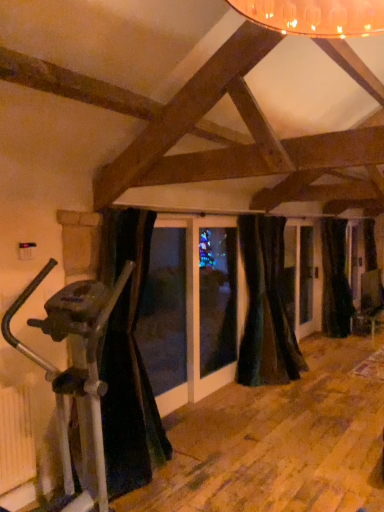
Where is `silver metallic stationary bicycle at left`? This screenshot has width=384, height=512. silver metallic stationary bicycle at left is located at coordinates (74, 366).

Describe the element at coordinates (128, 358) in the screenshot. I see `black velvet curtain at left, the 1th curtain from the left` at that location.

I want to click on black velvet curtain at left, which appears as the third curtain when viewed from the right, so click(x=128, y=358).

Where is `black velvet curtain at right, acting as the third curtain starting from the front`? Image resolution: width=384 pixels, height=512 pixels. black velvet curtain at right, acting as the third curtain starting from the front is located at coordinates (335, 279).

The height and width of the screenshot is (512, 384). I want to click on silver metallic stationary bicycle at left, so click(74, 366).

Is black velvet curtain at right, which is the 3th curtain from left to right, to the right of black velvet curtain at left, marked as the 1th curtain in a front-to-back arrangement, from the viewer's perspective?

Yes.

Are black velvet curtain at right, which is the 3th curtain from left to right, and black velvet curtain at left, the 1th curtain from the left, located far from each other?

Yes, black velvet curtain at right, which is the 3th curtain from left to right, and black velvet curtain at left, the 1th curtain from the left, are located far from each other.

Which point is more forward, (346, 225) or (74, 420)?

Point (74, 420)

How different are the orientations of black velvet curtain at right, acting as the third curtain starting from the front, and velvet dark green curtain at center, acting as the 2th curtain starting from the left, in degrees?

The angle between the facing direction of black velvet curtain at right, acting as the third curtain starting from the front, and the facing direction of velvet dark green curtain at center, acting as the 2th curtain starting from the left, is 0.00225 degrees.

Between black velvet curtain at right, acting as the third curtain starting from the front, and velvet dark green curtain at center, acting as the 2th curtain starting from the left, which one has smaller width?

black velvet curtain at right, acting as the third curtain starting from the front.

Considering the sizes of black velvet curtain at right, the 1th curtain positioned from the right, and velvet dark green curtain at center, the 2th curtain when ordered from front to back, in the image, is black velvet curtain at right, the 1th curtain positioned from the right, taller or shorter than velvet dark green curtain at center, the 2th curtain when ordered from front to back,?

Clearly, black velvet curtain at right, the 1th curtain positioned from the right, is taller compared to velvet dark green curtain at center, the 2th curtain when ordered from front to back.

The image size is (384, 512). I want to click on curtain behind the velvet dark green curtain at center, acting as the 2th curtain starting from the left, so [x=335, y=279].

Could you tell me if black velvet curtain at left, the 1th curtain from the left, is turned towards velvet dark green curtain at center, acting as the 2th curtain starting from the left?

No, black velvet curtain at left, the 1th curtain from the left, does not turn towards velvet dark green curtain at center, acting as the 2th curtain starting from the left.

Considering the sizes of black velvet curtain at left, the 1th curtain from the left, and velvet dark green curtain at center, acting as the 2th curtain starting from the left, in the image, is black velvet curtain at left, the 1th curtain from the left, taller or shorter than velvet dark green curtain at center, acting as the 2th curtain starting from the left,?

Clearly, black velvet curtain at left, the 1th curtain from the left, is shorter compared to velvet dark green curtain at center, acting as the 2th curtain starting from the left.

Does black velvet curtain at left, the 1th curtain from the left, have a larger size compared to velvet dark green curtain at center, positioned as the 2th curtain in right-to-left order?

Indeed, black velvet curtain at left, the 1th curtain from the left, has a larger size compared to velvet dark green curtain at center, positioned as the 2th curtain in right-to-left order.

Can you confirm if black velvet curtain at left, marked as the 1th curtain in a front-to-back arrangement, is thinner than velvet dark green curtain at center, acting as the 2th curtain starting from the left?

No.

Could you tell me if silver metallic stationary bicycle at left is turned towards velvet dark green curtain at center, the second curtain from the back?

No, silver metallic stationary bicycle at left is not oriented towards velvet dark green curtain at center, the second curtain from the back.

Is silver metallic stationary bicycle at left inside the boundaries of velvet dark green curtain at center, acting as the 2th curtain starting from the left, or outside?

silver metallic stationary bicycle at left is located beyond the bounds of velvet dark green curtain at center, acting as the 2th curtain starting from the left.

In the scene shown: Measure the distance between silver metallic stationary bicycle at left and velvet dark green curtain at center, the 2th curtain when ordered from front to back.

9.31 feet.

Would you say velvet dark green curtain at center, positioned as the 2th curtain in right-to-left order, contains silver metallic stationary bicycle at left?

No.

From the image's perspective, is velvet dark green curtain at center, acting as the 2th curtain starting from the left, on top of silver metallic stationary bicycle at left?

Yes, from the image's perspective, velvet dark green curtain at center, acting as the 2th curtain starting from the left, is above silver metallic stationary bicycle at left.

Is velvet dark green curtain at center, the 2th curtain when ordered from front to back, closer to the viewer compared to silver metallic stationary bicycle at left?

No, velvet dark green curtain at center, the 2th curtain when ordered from front to back, is further to the viewer.

Does black velvet curtain at right, the 1th curtain positioned from the back, lie in front of silver metallic stationary bicycle at left?

That is False.

How different are the orientations of black velvet curtain at right, which is the 3th curtain from left to right, and silver metallic stationary bicycle at left in degrees?

There is a 0.2-degree angle between the facing directions of black velvet curtain at right, which is the 3th curtain from left to right, and silver metallic stationary bicycle at left.

Is black velvet curtain at right, the 1th curtain positioned from the back, bigger or smaller than silver metallic stationary bicycle at left?

In the image, black velvet curtain at right, the 1th curtain positioned from the back, appears to be smaller than silver metallic stationary bicycle at left.

From a real-world perspective, is black velvet curtain at right, which is the 3th curtain from left to right, on silver metallic stationary bicycle at left?

Yes.

From the picture: Does velvet dark green curtain at center, the 2th curtain when ordered from front to back, contain black velvet curtain at left, which appears as the third curtain when viewed from the right?

No, black velvet curtain at left, which appears as the third curtain when viewed from the right, is not a part of velvet dark green curtain at center, the 2th curtain when ordered from front to back.

Is velvet dark green curtain at center, acting as the 2th curtain starting from the left, thinner than black velvet curtain at left, marked as the third curtain in a back-to-front arrangement?

Correct, the width of velvet dark green curtain at center, acting as the 2th curtain starting from the left, is less than that of black velvet curtain at left, marked as the third curtain in a back-to-front arrangement.

What's the angular difference between velvet dark green curtain at center, positioned as the 2th curtain in right-to-left order, and black velvet curtain at left, marked as the third curtain in a back-to-front arrangement,'s facing directions?

0.00028 degrees separate the facing orientations of velvet dark green curtain at center, positioned as the 2th curtain in right-to-left order, and black velvet curtain at left, marked as the third curtain in a back-to-front arrangement.

From the image's perspective, is velvet dark green curtain at center, the second curtain from the back, located above black velvet curtain at left, marked as the 1th curtain in a front-to-back arrangement?

Yes, from the image's perspective, velvet dark green curtain at center, the second curtain from the back, is over black velvet curtain at left, marked as the 1th curtain in a front-to-back arrangement.

Locate an element on the screen. This screenshot has height=512, width=384. the 2nd curtain behind the black velvet curtain at left, marked as the 1th curtain in a front-to-back arrangement, counting from the anchor's position is located at coordinates (335, 279).

You are a GUI agent. You are given a task and a screenshot of the screen. Output one action in this format:
    pyautogui.click(x=<x>, y=<y>)
    Task: Click on the curtain that is the 1st one when counting downward from the black velvet curtain at right, the 1th curtain positioned from the back (from the image's perspective)
    
    Given the screenshot: What is the action you would take?
    pyautogui.click(x=266, y=306)

Which object lies nearer to the anchor point black velvet curtain at left, the 1th curtain from the left, silver metallic stationary bicycle at left or velvet dark green curtain at center, the 2th curtain when ordered from front to back?

silver metallic stationary bicycle at left lies closer to black velvet curtain at left, the 1th curtain from the left, than the other object.

Considering their positions, is black velvet curtain at right, the 1th curtain positioned from the right, positioned closer to black velvet curtain at left, which appears as the third curtain when viewed from the right, than velvet dark green curtain at center, the second curtain from the back?

velvet dark green curtain at center, the second curtain from the back, lies closer to black velvet curtain at left, which appears as the third curtain when viewed from the right, than the other object.

Looking at the image, which one is located closer to black velvet curtain at left, marked as the 1th curtain in a front-to-back arrangement, silver metallic stationary bicycle at left or black velvet curtain at right, which is the 3th curtain from left to right?

silver metallic stationary bicycle at left is positioned closer to the anchor black velvet curtain at left, marked as the 1th curtain in a front-to-back arrangement.

Looking at the image, which one is located further to silver metallic stationary bicycle at left, black velvet curtain at left, which appears as the third curtain when viewed from the right, or black velvet curtain at right, the 1th curtain positioned from the right?

The object further to silver metallic stationary bicycle at left is black velvet curtain at right, the 1th curtain positioned from the right.

When comparing their distances from silver metallic stationary bicycle at left, does velvet dark green curtain at center, acting as the 2th curtain starting from the left, or black velvet curtain at right, acting as the third curtain starting from the front, seem closer?

velvet dark green curtain at center, acting as the 2th curtain starting from the left, lies closer to silver metallic stationary bicycle at left than the other object.

Looking at the image, which one is located closer to silver metallic stationary bicycle at left, black velvet curtain at right, the 1th curtain positioned from the back, or black velvet curtain at left, which appears as the third curtain when viewed from the right?

black velvet curtain at left, which appears as the third curtain when viewed from the right.

Estimate the real-world distances between objects in this image. Which object is further from black velvet curtain at left, which appears as the third curtain when viewed from the right, velvet dark green curtain at center, positioned as the 2th curtain in right-to-left order, or black velvet curtain at right, the 1th curtain positioned from the right?

black velvet curtain at right, the 1th curtain positioned from the right, lies further to black velvet curtain at left, which appears as the third curtain when viewed from the right, than the other object.

Considering their positions, is black velvet curtain at left, which appears as the third curtain when viewed from the right, positioned further to velvet dark green curtain at center, the 2th curtain when ordered from front to back, than silver metallic stationary bicycle at left?

Based on the image, silver metallic stationary bicycle at left appears to be further to velvet dark green curtain at center, the 2th curtain when ordered from front to back.

At what (x,y) coordinates should I click in order to perform the action: click on curtain between black velvet curtain at left, marked as the third curtain in a back-to-front arrangement, and black velvet curtain at right, the 1th curtain positioned from the right, from front to back. Please return your answer as a coordinate pair (x, y). The image size is (384, 512). Looking at the image, I should click on (266, 306).

Where is `curtain positioned between silver metallic stationary bicycle at left and velvet dark green curtain at center, acting as the 2th curtain starting from the left, from near to far`? The height and width of the screenshot is (512, 384). curtain positioned between silver metallic stationary bicycle at left and velvet dark green curtain at center, acting as the 2th curtain starting from the left, from near to far is located at coordinates (128, 358).